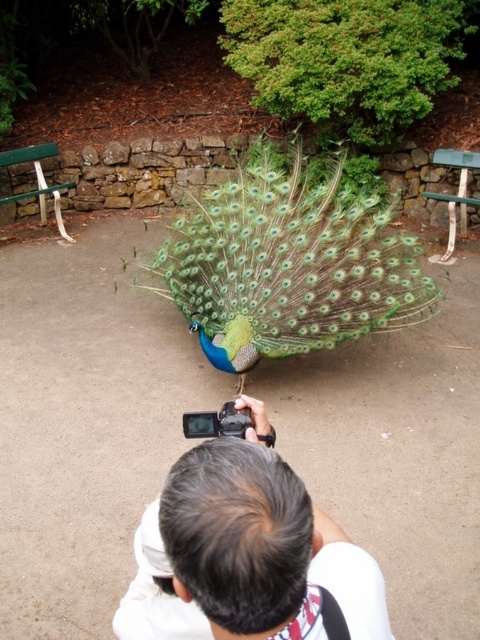
This screenshot has height=640, width=480. Describe the element at coordinates (288, 266) in the screenshot. I see `shiny blue peacock at center` at that location.

Who is more distant from viewer, (355, 211) or (474, 204)?

Positioned behind is point (474, 204).

Does point (314, 253) come closer to viewer compared to point (443, 259)?

Yes.

Where is `shiny blue peacock at center`? The height and width of the screenshot is (640, 480). shiny blue peacock at center is located at coordinates (288, 266).

Is shiny blue peacock at center taller than green painted wood park bench at left?

Yes.

Is shiny blue peacock at center positioned before green painted wood park bench at left?

Yes, it is in front of green painted wood park bench at left.

Between point (204, 204) and point (55, 150), which one is positioned in front?

Point (204, 204) is in front.

Image resolution: width=480 pixels, height=640 pixels. Find the location of `shiny blue peacock at center`. shiny blue peacock at center is located at coordinates (288, 266).

From the picture: Is green plastic bench at upper right wider than green painted wood park bench at left?

Incorrect, green plastic bench at upper right's width does not surpass green painted wood park bench at left's.

Does green plastic bench at upper right have a lesser height compared to green painted wood park bench at left?

Incorrect, green plastic bench at upper right's height does not fall short of green painted wood park bench at left's.

Does point (447, 232) lie in front of point (55, 154)?

Yes.

Find the location of a particular element. This screenshot has width=480, height=640. green plastic bench at upper right is located at coordinates (456, 193).